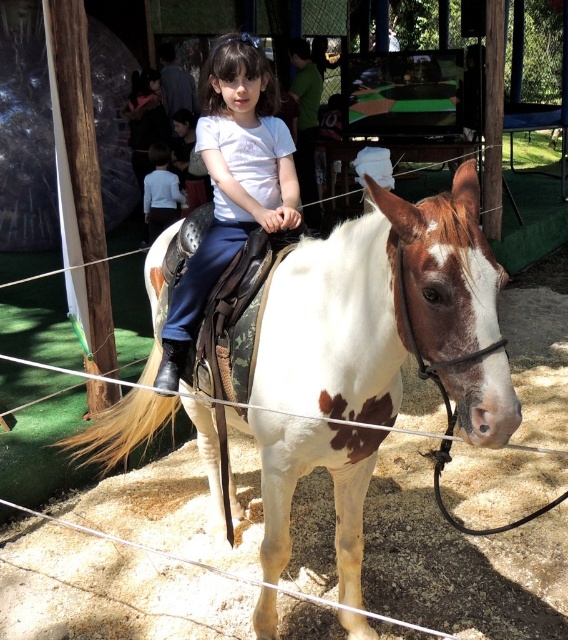
This screenshot has width=568, height=640. Describe the element at coordinates (377, 305) in the screenshot. I see `white speckled horse at center` at that location.

Does white speckled horse at center have a lesser height compared to light blue shirt at center?

Incorrect, white speckled horse at center's height does not fall short of light blue shirt at center's.

Between point (126, 432) and point (152, 234), which one is positioned behind?

The point (152, 234) is behind.

In order to click on white speckled horse at center in this screenshot , I will do `click(377, 305)`.

Is white speckled horse at center further to the viewer compared to white matte shirt at center?

No, it is not.

Does white speckled horse at center have a lesser width compared to white matte shirt at center?

Incorrect, white speckled horse at center's width is not less than white matte shirt at center's.

Which is behind, point (369, 412) or point (216, 200)?

Point (216, 200)

Where is `white speckled horse at center`? white speckled horse at center is located at coordinates (377, 305).

Is white matte shirt at center bigger than light blue shirt at center?

Yes, white matte shirt at center is bigger than light blue shirt at center.

Find the location of `white matte shirt at center`. white matte shirt at center is located at coordinates (231, 182).

Image resolution: width=568 pixels, height=640 pixels. What do you see at coordinates (231, 182) in the screenshot?
I see `white matte shirt at center` at bounding box center [231, 182].

At what (x,y) coordinates should I click in order to perform the action: click on white matte shirt at center. Please return your answer as a coordinate pair (x, y). Looking at the image, I should click on (231, 182).